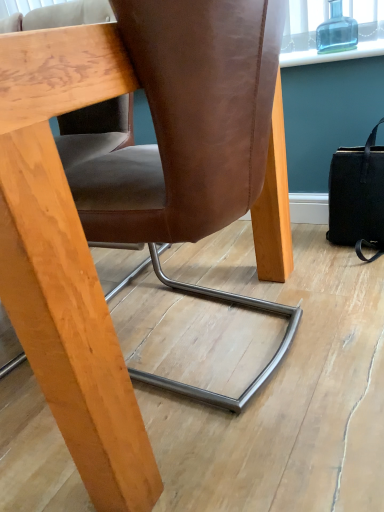
Image resolution: width=384 pixels, height=512 pixels. What do you see at coordinates (357, 197) in the screenshot?
I see `black leather handbag at right` at bounding box center [357, 197].

Where is `transparent glass bottle at upper right`? transparent glass bottle at upper right is located at coordinates (336, 31).

Is brown leather chair at center to the right of black leather handbag at right from the viewer's perspective?

Incorrect, brown leather chair at center is not on the right side of black leather handbag at right.

Is there a large distance between brown leather chair at center and black leather handbag at right?

brown leather chair at center is actually quite close to black leather handbag at right.

Looking at their sizes, would you say brown leather chair at center is wider or thinner than black leather handbag at right?

In the image, brown leather chair at center appears to be wider than black leather handbag at right.

Considering the sizes of objects brown leather chair at center and black leather handbag at right in the image provided, who is bigger, brown leather chair at center or black leather handbag at right?

brown leather chair at center is bigger.

From a real-world perspective, does black leather handbag at right sit lower than brown leather chair at center?

Yes.

Is black leather handbag at right looking in the opposite direction of brown leather chair at center?

black leather handbag at right is not turned away from brown leather chair at center.

From the image's perspective, is black leather handbag at right below brown leather chair at center?

No, from the image's perspective, black leather handbag at right is not beneath brown leather chair at center.

Considering the positions of objects black leather handbag at right and brown leather chair at center in the image provided, who is more to the left, black leather handbag at right or brown leather chair at center?

brown leather chair at center is more to the left.

Locate an element on the screen. bottle behind the brown leather chair at center is located at coordinates (336, 31).

Which of these two, transparent glass bottle at upper right or brown leather chair at center, is bigger?

With larger size is brown leather chair at center.

Between point (338, 47) and point (130, 12), which one is positioned behind?

Positioned behind is point (338, 47).

Is transparent glass bottle at upper right oriented away from brown leather chair at center?

transparent glass bottle at upper right does not have its back to brown leather chair at center.

Does transparent glass bottle at upper right lie in front of black leather handbag at right?

No, transparent glass bottle at upper right is further to the viewer.

How different are the orientations of transparent glass bottle at upper right and black leather handbag at right in degrees?

The angular difference between transparent glass bottle at upper right and black leather handbag at right is 1.29 degrees.

I want to click on bottle to the left of black leather handbag at right, so click(x=336, y=31).

From a real-world perspective, between transparent glass bottle at upper right and black leather handbag at right, who is vertically lower?

black leather handbag at right.

Is brown leather chair at center far from transparent glass bottle at upper right?

Actually, brown leather chair at center and transparent glass bottle at upper right are a little close together.

Does brown leather chair at center contain transparent glass bottle at upper right?

No.

Is brown leather chair at center positioned with its back to transparent glass bottle at upper right?

That's not correct — brown leather chair at center is not looking away from transparent glass bottle at upper right.

Which of these two, brown leather chair at center or transparent glass bottle at upper right, is bigger?

brown leather chair at center is bigger.

From the image's perspective, is black leather handbag at right located beneath transparent glass bottle at upper right?

Yes.

Considering the relative sizes of black leather handbag at right and transparent glass bottle at upper right in the image provided, is black leather handbag at right shorter than transparent glass bottle at upper right?

Incorrect, the height of black leather handbag at right does not fall short of that of transparent glass bottle at upper right.

From the picture: Visually, is black leather handbag at right positioned to the left or to the right of transparent glass bottle at upper right?

black leather handbag at right is to the right of transparent glass bottle at upper right.

Is black leather handbag at right wider than transparent glass bottle at upper right?

Yes, black leather handbag at right is wider than transparent glass bottle at upper right.

In the image, there is a black leather handbag at right. Identify the location of chair below it (from the image's perspective). The image size is (384, 512). (191, 143).

At what (x,y) coordinates should I click in order to perform the action: click on handbag below the brown leather chair at center (from a real-world perspective). Please return your answer as a coordinate pair (x, y). Image resolution: width=384 pixels, height=512 pixels. Looking at the image, I should click on (357, 197).

Based on the photo, estimate the real-world distances between objects in this image. Which object is closer to brown leather chair at center, transparent glass bottle at upper right or black leather handbag at right?

black leather handbag at right is closer to brown leather chair at center.

Estimate the real-world distances between objects in this image. Which object is further from transparent glass bottle at upper right, brown leather chair at center or black leather handbag at right?

brown leather chair at center is positioned further to the anchor transparent glass bottle at upper right.

Estimate the real-world distances between objects in this image. Which object is closer to transparent glass bottle at upper right, black leather handbag at right or brown leather chair at center?

black leather handbag at right is positioned closer to the anchor transparent glass bottle at upper right.

Looking at the image, which one is located further to black leather handbag at right, transparent glass bottle at upper right or brown leather chair at center?

brown leather chair at center is further to black leather handbag at right.

Looking at the image, which one is located closer to black leather handbag at right, brown leather chair at center or transparent glass bottle at upper right?

transparent glass bottle at upper right is closer to black leather handbag at right.

Based on their spatial positions, is black leather handbag at right or transparent glass bottle at upper right further from brown leather chair at center?

Among the two, transparent glass bottle at upper right is located further to brown leather chair at center.

The height and width of the screenshot is (512, 384). In order to click on handbag located between brown leather chair at center and transparent glass bottle at upper right in the depth direction in this screenshot , I will do `click(357, 197)`.